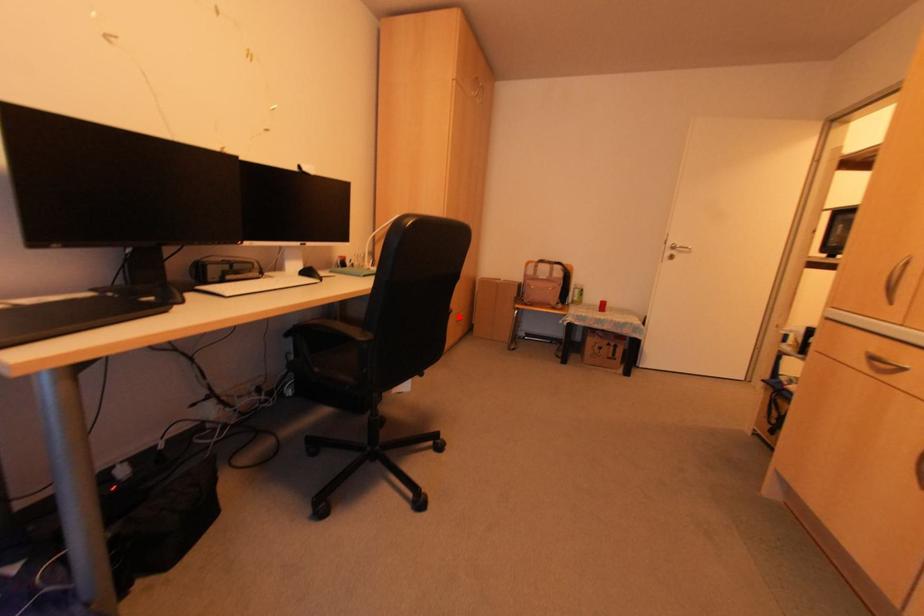
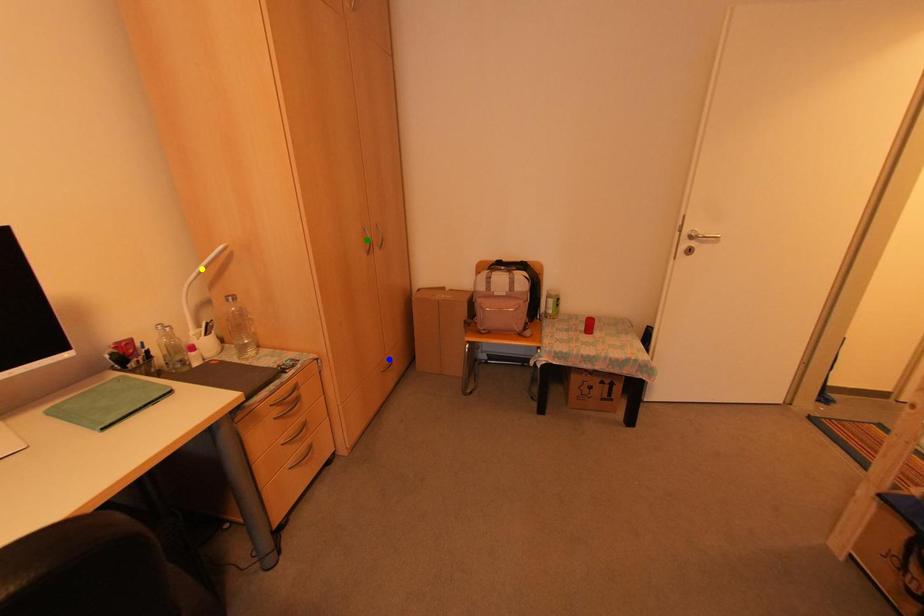
Question: I am providing you with two images of the same scene from different viewpoints. A red point is marked on the first image. You are given multiple points on the second image. Can you choose the point in image 2 that corresponds to the point in image 1?

Choices:
 (A) green point
 (B) blue point
 (C) yellow point

Answer: (B)